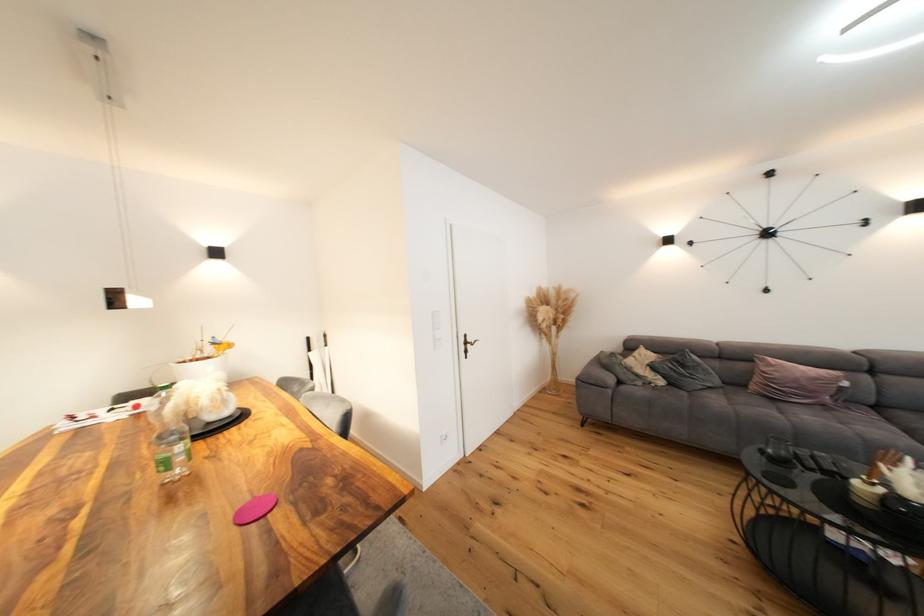
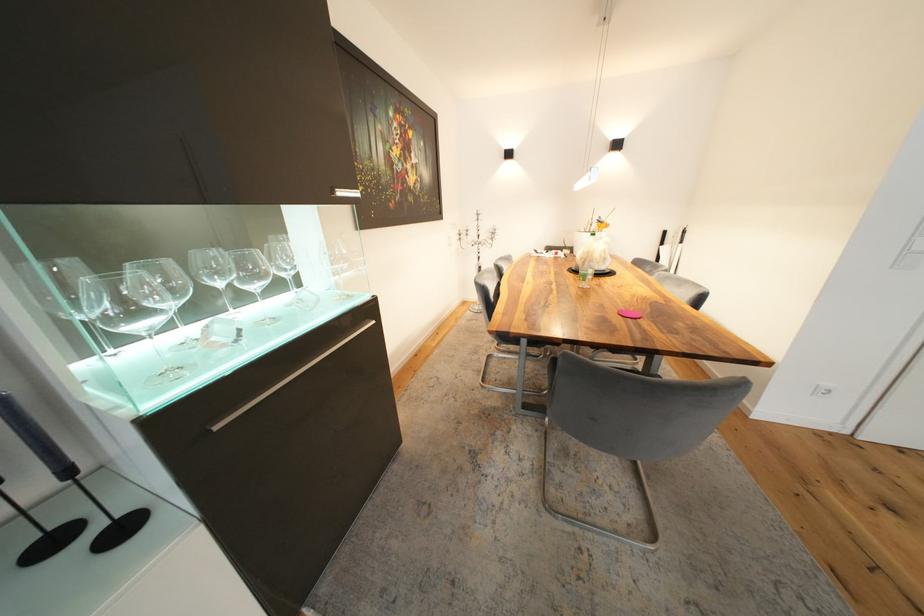
Locate, in the second image, the point that corresponds to (195,405) in the first image.

(594, 254)